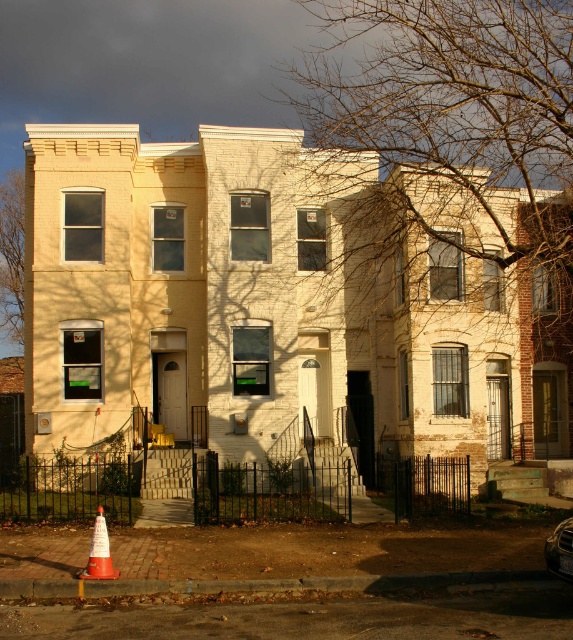
Question: Among these objects, which one is nearest to the camera?

Choices:
 (A) orange matte traffic cone at lower left
 (B) shiny silver car at center

Answer: (B)

Question: Does orange matte traffic cone at lower left have a larger size compared to shiny silver car at center?

Choices:
 (A) no
 (B) yes

Answer: (B)

Question: Can you confirm if orange matte traffic cone at lower left is smaller than shiny silver car at center?

Choices:
 (A) no
 (B) yes

Answer: (A)

Question: Does orange matte traffic cone at lower left appear under shiny silver car at center?

Choices:
 (A) yes
 (B) no

Answer: (A)

Question: Among these objects, which one is farthest from the camera?

Choices:
 (A) shiny silver car at center
 (B) orange matte traffic cone at lower left

Answer: (B)